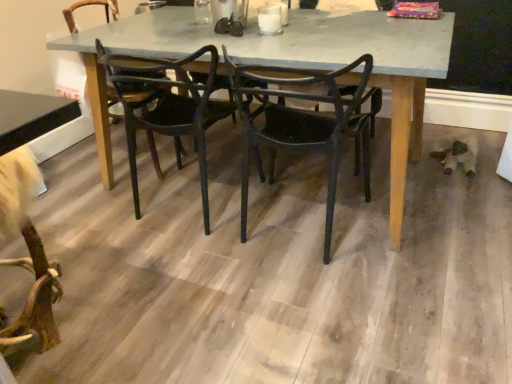
Question: Does black matte chair at center, positioned as the second chair in left-to-right order, turn towards wooden floor at center?

Choices:
 (A) yes
 (B) no

Answer: (B)

Question: Does black matte chair at center, the first chair from the right, appear on the right side of wooden floor at center?

Choices:
 (A) yes
 (B) no

Answer: (A)

Question: Is black matte chair at center, positioned as the second chair in left-to-right order, with wooden floor at center?

Choices:
 (A) yes
 (B) no

Answer: (B)

Question: Is black matte chair at center, the first chair from the right, positioned with its back to wooden floor at center?

Choices:
 (A) no
 (B) yes

Answer: (A)

Question: From the image's perspective, is black matte chair at center, positioned as the second chair in left-to-right order, located above wooden floor at center?

Choices:
 (A) no
 (B) yes

Answer: (B)

Question: Considering the relative positions of matte gray table at center and black plastic chair at center, the second chair when ordered from right to left, in the image provided, is matte gray table at center to the left or to the right of black plastic chair at center, the second chair when ordered from right to left,?

Choices:
 (A) left
 (B) right

Answer: (B)

Question: Is matte gray table at center in front of or behind black plastic chair at center, the second chair when ordered from right to left, in the image?

Choices:
 (A) behind
 (B) front

Answer: (B)

Question: Considering the positions of matte gray table at center and black plastic chair at center, which ranks as the first chair in left-to-right order, in the image, is matte gray table at center taller or shorter than black plastic chair at center, which ranks as the first chair in left-to-right order,?

Choices:
 (A) short
 (B) tall

Answer: (A)

Question: In terms of width, does matte gray table at center look wider or thinner when compared to black plastic chair at center, which ranks as the first chair in left-to-right order?

Choices:
 (A) thin
 (B) wide

Answer: (B)

Question: Looking at the image, does black matte chair at center, the first chair from the right, seem bigger or smaller compared to matte gray table at center?

Choices:
 (A) big
 (B) small

Answer: (B)

Question: Considering the positions of black matte chair at center, positioned as the second chair in left-to-right order, and matte gray table at center in the image, is black matte chair at center, positioned as the second chair in left-to-right order, taller or shorter than matte gray table at center?

Choices:
 (A) short
 (B) tall

Answer: (B)

Question: In terms of width, does black matte chair at center, the first chair from the right, look wider or thinner when compared to matte gray table at center?

Choices:
 (A) thin
 (B) wide

Answer: (A)

Question: In the image, is black matte chair at center, positioned as the second chair in left-to-right order, positioned in front of or behind matte gray table at center?

Choices:
 (A) front
 (B) behind

Answer: (A)

Question: From a real-world perspective, relative to wooden floor at center, is black matte chair at center, the first chair from the right, vertically above or below?

Choices:
 (A) above
 (B) below

Answer: (A)

Question: Choose the correct answer: Is black matte chair at center, positioned as the second chair in left-to-right order, inside wooden floor at center or outside it?

Choices:
 (A) outside
 (B) inside

Answer: (A)